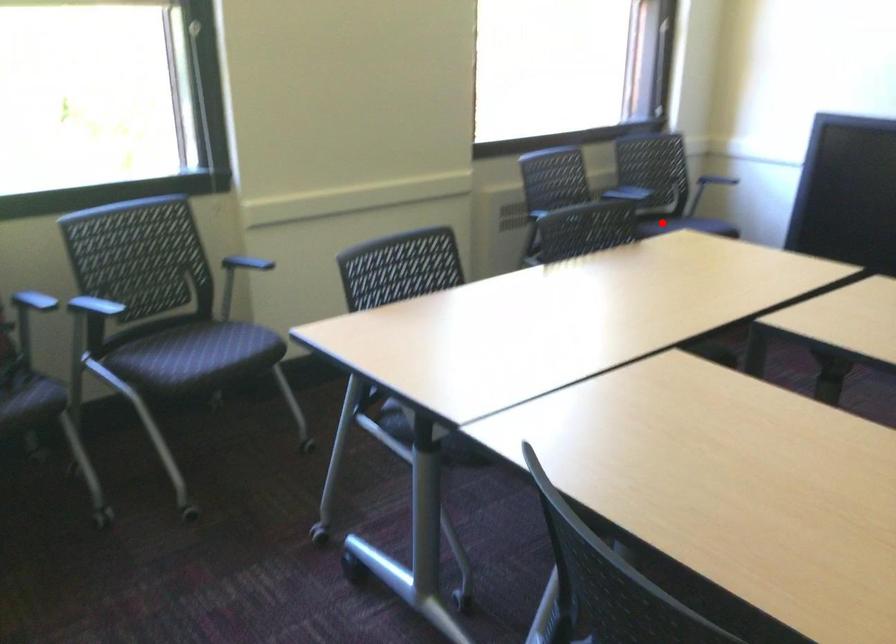
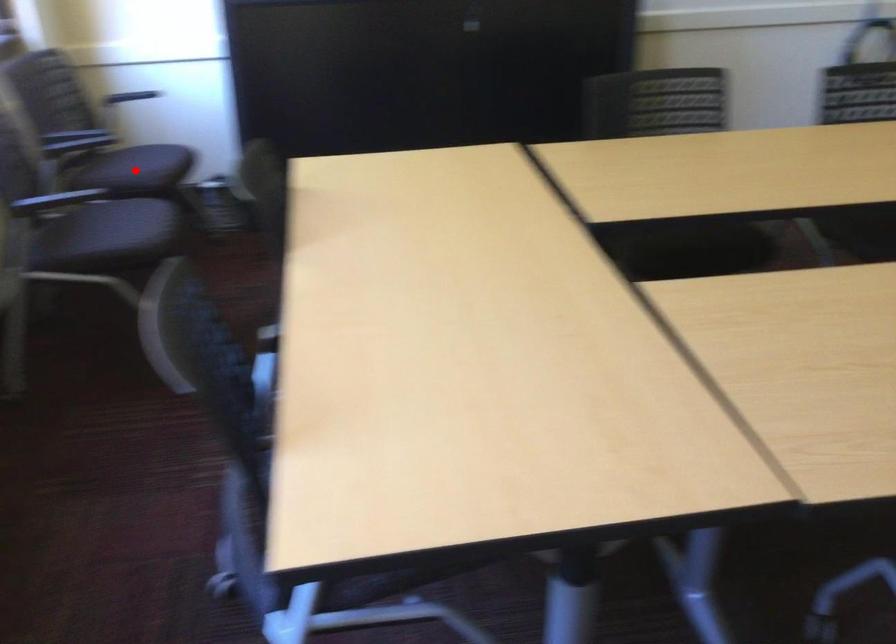
I am providing you with two images of the same scene from different viewpoints. A red point is marked on the first image and another point is marked on the second image. Is the marked point in image1 the same physical position as the marked point in image2?

Yes